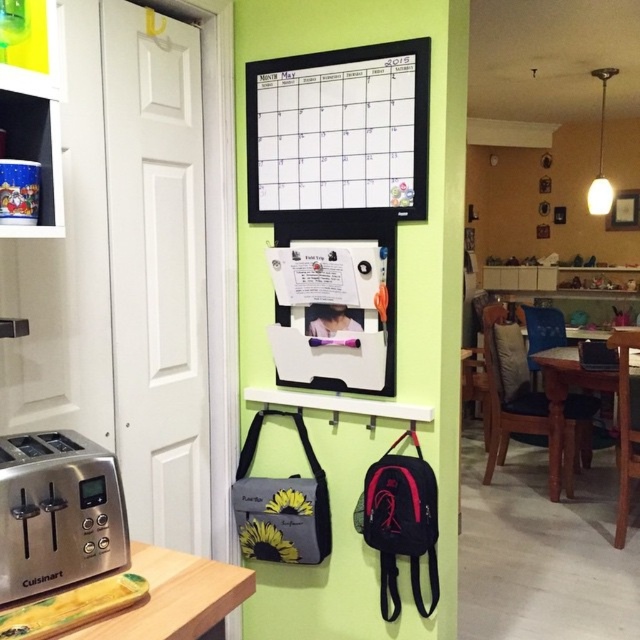
You are organizing a party and need to check the availability of the brown wooden table at center. You see the white matte calendar at upper center hanging on the wall. Is the calendar positioned in a way that it might block your view of the table?

The white matte calendar at upper center is above the brown wooden table at center, so it could potentially block the view of the table depending on its size and the angle from which you are looking.

You are a chef preparing a meal and need to place a tall soup bowl on the surface closest to you. Which table should you choose between the wooden table at lower left and the brown wooden table at center?

The brown wooden table at center is taller, so the chef should choose the brown wooden table at center to place the tall soup bowl since it has a higher surface.